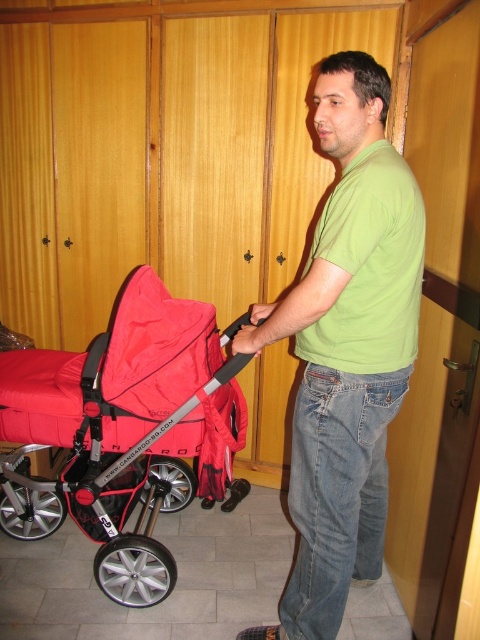
From the picture: You are navigating a hallway with wooden paneling and need to reach a destination located at point (180, 403). You are currently at point (394, 244). Which direction should you move to get closer to your destination?

Since point (394, 244) is closer to the viewer than point (180, 403), you should move away from the viewer to reach your destination.

You are a photographer trying to capture the man in the hallway. You notice the green matte shirt at center and the red fabric stroller at left. Which object should you focus on first if you want to photograph the taller one?

The green matte shirt at center is taller than the red fabric stroller at left, so you should focus on the green matte shirt at center first.

You are a security camera monitoring the hallway. You notice the green matte shirt at center and the red fabric stroller at left. Which object is closer to the camera?

The green matte shirt at center is closer to the camera because it is in front of the red fabric stroller at left.